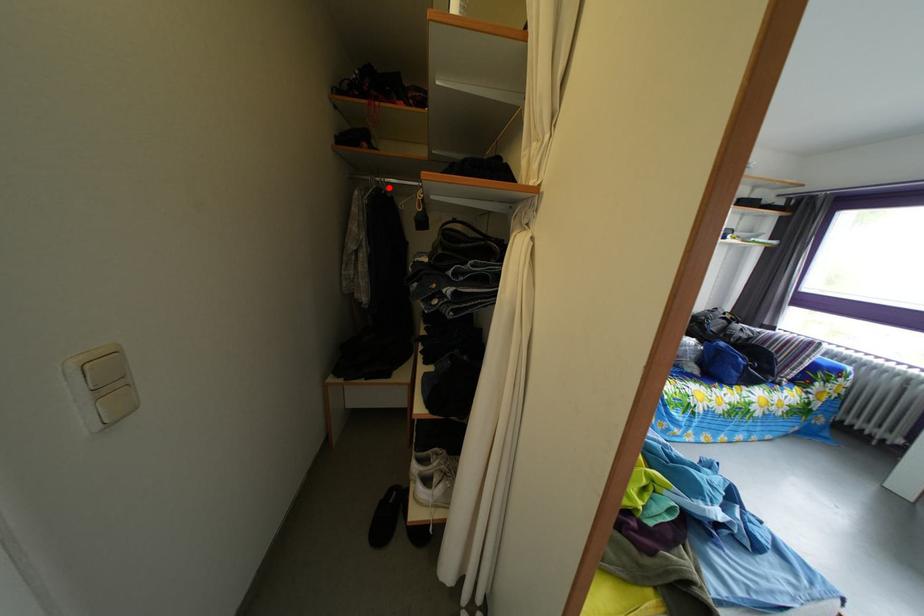
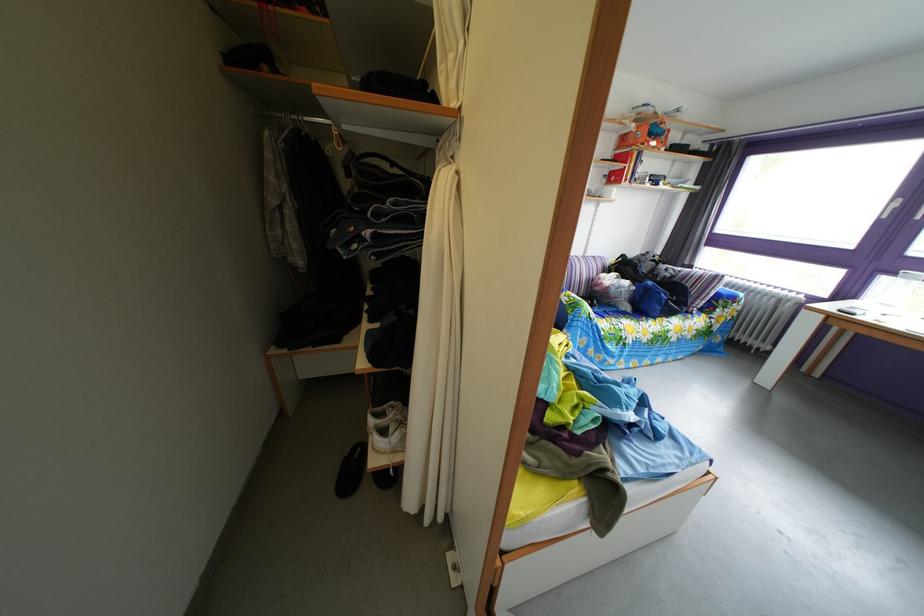
The point at the highlighted location is marked in the first image. Where is the corresponding point in the second image?

(306, 126)